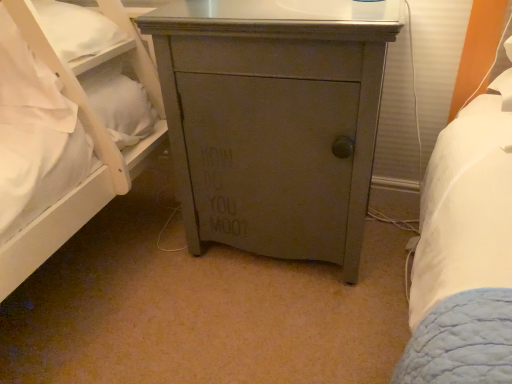
In the scene shown: Measure the distance between point (x=73, y=110) and camera.

Point (x=73, y=110) and camera are 3.83 feet apart.

This screenshot has height=384, width=512. What do you see at coordinates (29, 84) in the screenshot?
I see `white soft pillow at left` at bounding box center [29, 84].

Where is `white soft pillow at left`? The width and height of the screenshot is (512, 384). white soft pillow at left is located at coordinates point(29,84).

The height and width of the screenshot is (384, 512). Describe the element at coordinates (273, 120) in the screenshot. I see `matte gray cabinet at center` at that location.

Measure the distance between point (x=294, y=247) and camera.

4.34 feet.

What are the coordinates of `matte gray cabinet at center` in the screenshot? It's located at (273, 120).

Where is `white soft pillow at left`? This screenshot has height=384, width=512. white soft pillow at left is located at coordinates (29, 84).

Does matte gray cabinet at center appear on the left side of white soft pillow at left?

No, matte gray cabinet at center is not to the left of white soft pillow at left.

Which object is closer to the camera, matte gray cabinet at center or white soft pillow at left?

matte gray cabinet at center is in front.

Which is further, (x=399, y=8) or (x=9, y=79)?

The point (x=9, y=79) is farther from the camera.

From the image's perspective, would you say matte gray cabinet at center is positioned over white soft pillow at left?

No.

From a real-world perspective, which is physically below, matte gray cabinet at center or white soft pillow at left?

From a 3D spatial view, matte gray cabinet at center is below.

Considering the sizes of objects matte gray cabinet at center and white soft pillow at left in the image provided, who is thinner, matte gray cabinet at center or white soft pillow at left?

white soft pillow at left.

Between matte gray cabinet at center and white soft pillow at left, which one has more height?

With more height is matte gray cabinet at center.

Is matte gray cabinet at center smaller than white soft pillow at left?

No.

Is white soft pillow at left located within matte gray cabinet at center?

No, white soft pillow at left is located outside of matte gray cabinet at center.

Are matte gray cabinet at center and white soft pillow at left beside each other?

No, matte gray cabinet at center is not next to white soft pillow at left.

Is matte gray cabinet at center positioned with its back to white soft pillow at left?

No, matte gray cabinet at center's orientation is not away from white soft pillow at left.

Identify the location of pillow lying above the matte gray cabinet at center (from the image's perspective). This screenshot has height=384, width=512. (29, 84).

Does white soft pillow at left appear on the right side of matte gray cabinet at center?

In fact, white soft pillow at left is to the left of matte gray cabinet at center.

Who is more distant, white soft pillow at left or matte gray cabinet at center?

white soft pillow at left is further away from the camera.

Is point (51, 110) closer to camera compared to point (285, 140)?

No.

From the image's perspective, is white soft pillow at left located beneath matte gray cabinet at center?

No, from the image's perspective, white soft pillow at left is not beneath matte gray cabinet at center.

From a real-world perspective, is white soft pillow at left positioned above or below matte gray cabinet at center?

In terms of real-world spatial position, white soft pillow at left is above matte gray cabinet at center.

Is white soft pillow at left wider or thinner than matte gray cabinet at center?

Clearly, white soft pillow at left has less width compared to matte gray cabinet at center.

In terms of height, does white soft pillow at left look taller or shorter compared to matte gray cabinet at center?

In the image, white soft pillow at left appears to be shorter than matte gray cabinet at center.

Considering the sizes of objects white soft pillow at left and matte gray cabinet at center in the image provided, who is bigger, white soft pillow at left or matte gray cabinet at center?

With larger size is matte gray cabinet at center.

Does white soft pillow at left contain matte gray cabinet at center?

No, matte gray cabinet at center is not inside white soft pillow at left.

Would you consider white soft pillow at left to be distant from matte gray cabinet at center?

No, there isn't a large distance between white soft pillow at left and matte gray cabinet at center.

Is white soft pillow at left aimed at matte gray cabinet at center?

No, white soft pillow at left is not turned towards matte gray cabinet at center.

What's the angular difference between white soft pillow at left and matte gray cabinet at center's facing directions?

The facing directions of white soft pillow at left and matte gray cabinet at center are 1.29 degrees apart.

Consider the image. How much distance is there between white soft pillow at left and matte gray cabinet at center?

20.51 inches.

Find the location of a particular element. Image resolution: width=512 pixels, height=384 pixels. pillow lying behind the matte gray cabinet at center is located at coordinates (29, 84).

Locate an element on the screen. the chest of drawers in front of the white soft pillow at left is located at coordinates (273, 120).

The image size is (512, 384). I want to click on the chest of drawers below the white soft pillow at left (from the image's perspective), so click(273, 120).